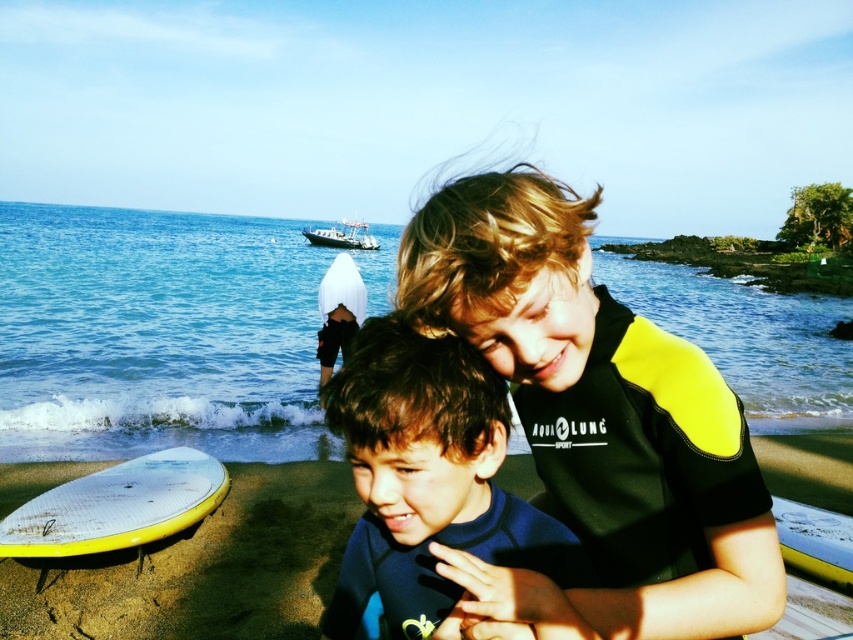
Is blue water at center further to camera compared to yellow matte surfboard at lower left?

Yes.

Who is lower down, blue water at center or yellow matte surfboard at lower left?

yellow matte surfboard at lower left is below.

Who is more forward, (85, 438) or (96, 499)?

Point (96, 499) is more forward.

The height and width of the screenshot is (640, 853). Identify the location of blue water at center. coord(155,333).

Is point (460, 368) behind point (373, 241)?

No.

Who is more forward, [404,410] or [328,243]?

Point [404,410]

Where is `blue matte wetsuit at center`? This screenshot has height=640, width=853. blue matte wetsuit at center is located at coordinates (427, 481).

Is black neoprene wetsuit at center closer to camera compared to yellow matte surfboard at lower left?

Yes, it is in front of yellow matte surfboard at lower left.

Is black neoprene wetsuit at center behind yellow matte surfboard at lower left?

No.

Find the location of a particular element. Image resolution: width=853 pixels, height=640 pixels. black neoprene wetsuit at center is located at coordinates (596, 420).